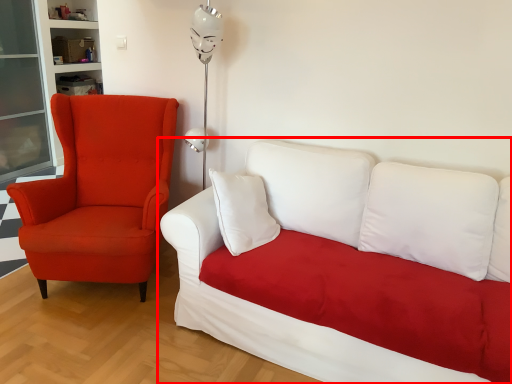
Question: From the image's perspective, considering the relative positions of studio couch (annotated by the red box) and chair in the image provided, where is studio couch (annotated by the red box) located with respect to the staircase?

Choices:
 (A) below
 (B) above

Answer: (A)